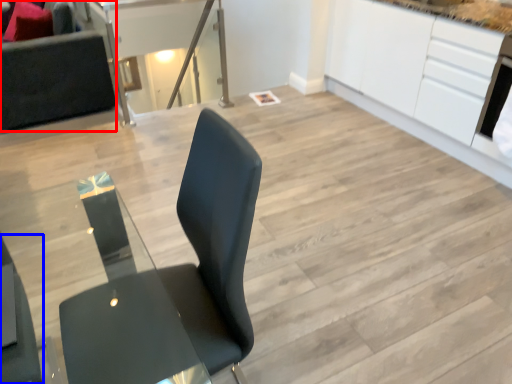
Question: Which object appears farthest to the camera in this image, couch (highlighted by a red box) or chair (highlighted by a blue box)?

Choices:
 (A) couch
 (B) chair

Answer: (A)